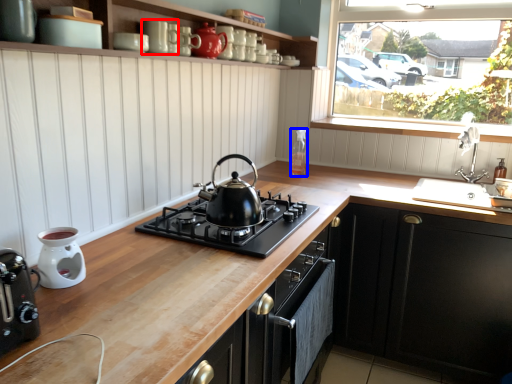
Question: Which object appears farthest to the camera in this image, appliance (highlighted by a red box) or appliance (highlighted by a blue box)?

Choices:
 (A) appliance
 (B) appliance

Answer: (B)